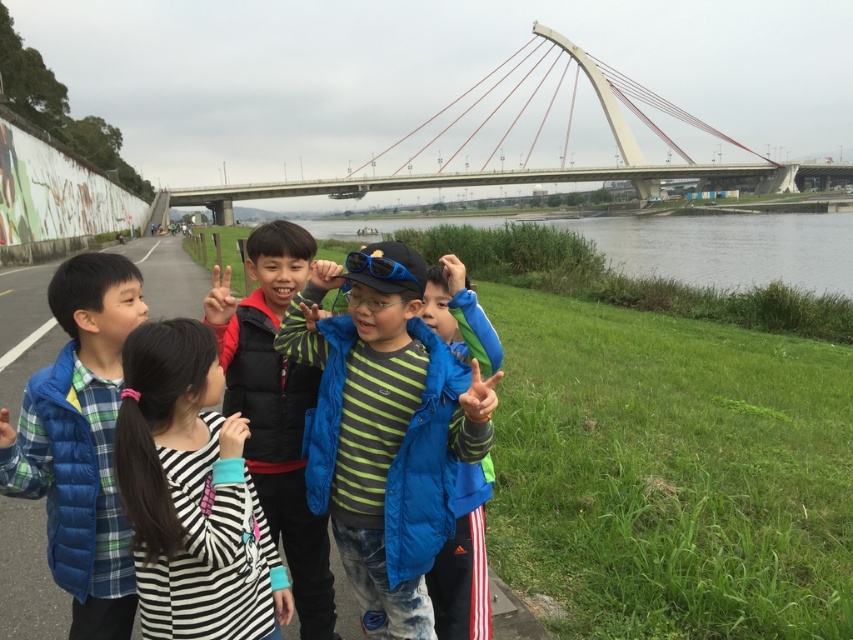
Which of these two, green grass at lower right or blue fleece jacket at center, stands taller?

With more height is green grass at lower right.

Does green grass at lower right have a greater width compared to blue fleece jacket at center?

Yes.

Who is more distant from viewer, (796,216) or (457,467)?

The point (796,216) is behind.

Find the location of a particular element. Image resolution: width=853 pixels, height=640 pixels. green grass at lower right is located at coordinates pos(727,248).

This screenshot has width=853, height=640. In order to click on green striped shirt at center in this screenshot , I will do [384, 429].

Between green striped shirt at center and matte black vest at center, which one appears on the right side from the viewer's perspective?

green striped shirt at center

I want to click on green striped shirt at center, so click(x=384, y=429).

Can you confirm if green striped shirt at center is positioned to the right of blue fleece jacket at center?

Incorrect, green striped shirt at center is not on the right side of blue fleece jacket at center.

Who is more distant from viewer, [424,378] or [473,624]?

The point [473,624] is more distant.

This screenshot has width=853, height=640. I want to click on green striped shirt at center, so click(384, 429).

What are the coordinates of `green striped shirt at center` in the screenshot? It's located at (384, 429).